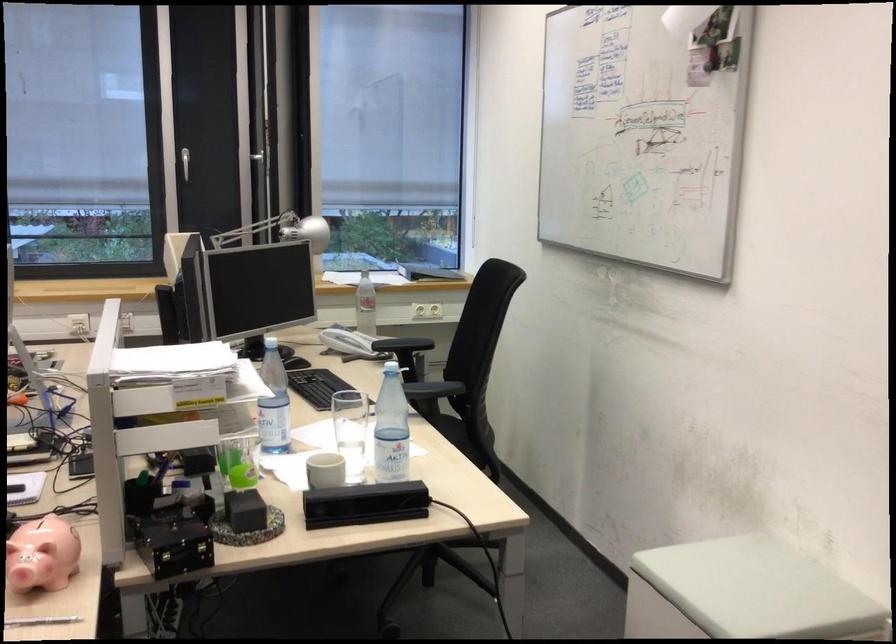
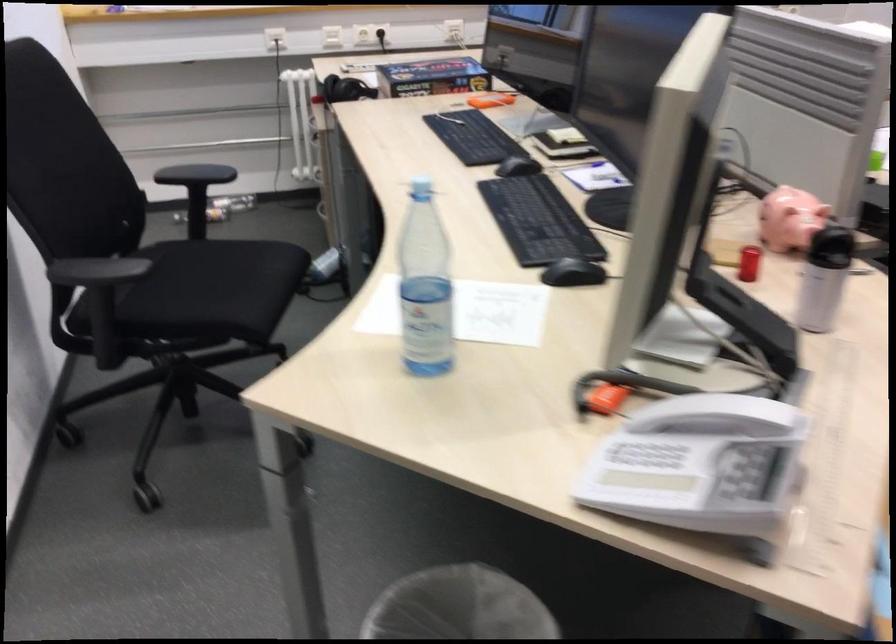
Question: In a continuous first-person perspective shot, in which direction is the camera moving?

Choices:
 (A) Left
 (B) Right
 (C) Forward
 (D) Backward

Answer: (A)